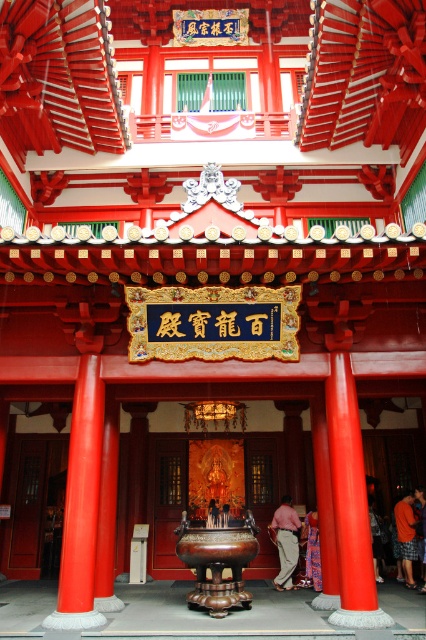
You are an architect designing a new temple entrance and want to ensure proper spacing between the entrance and the two objects in the image. The matte red person at center and the orange fabric pants at center are both positioned at the entrance. Which object requires more horizontal space due to its greater width?

The matte red person at center requires more horizontal space because its width surpasses that of the orange fabric pants at center.

You are a visitor standing at the entrance of the temple and want to place a 9 feet long banner between the pink fabric pants at center and the orange cotton shorts at lower right. Will the banner fit without overlapping either object?

The distance between the pink fabric pants at center and the orange cotton shorts at lower right is 8.10 feet. Since the banner is 9 feet long, it will not fit as it is longer than the available space between them.